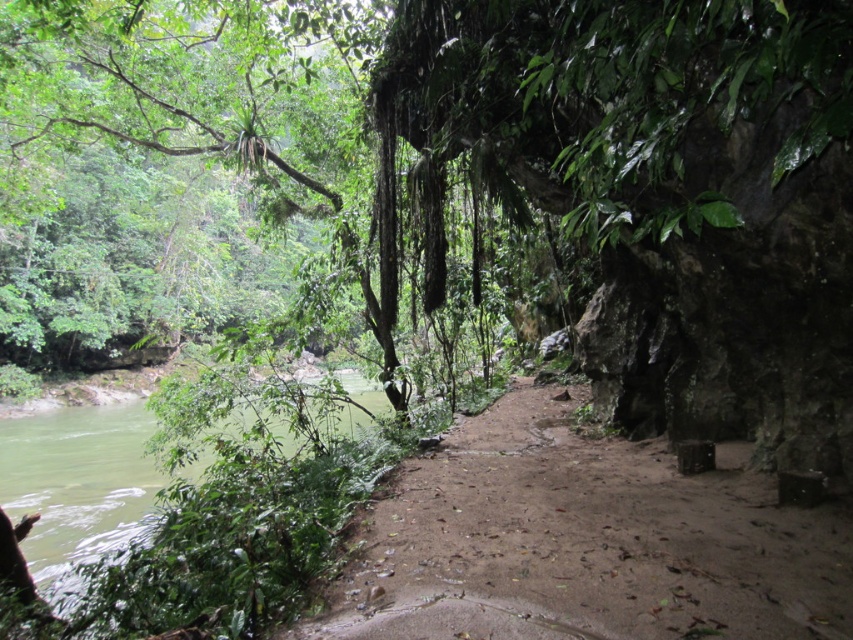
Question: Which point is farther to the camera?

Choices:
 (A) green leafy tree at upper left
 (B) brown sandy dirt track at center

Answer: (A)

Question: Does green leafy tree at upper left have a greater width compared to brown sandy dirt track at center?

Choices:
 (A) yes
 (B) no

Answer: (A)

Question: Which of the following is the closest to the observer?

Choices:
 (A) green leafy tree at upper left
 (B) brown sandy dirt track at center

Answer: (B)

Question: Does green leafy tree at upper left appear under brown sandy dirt track at center?

Choices:
 (A) yes
 (B) no

Answer: (B)

Question: Among these objects, which one is nearest to the camera?

Choices:
 (A) green leafy tree at upper left
 (B) brown sandy dirt track at center

Answer: (B)

Question: Does green leafy tree at upper left appear under brown sandy dirt track at center?

Choices:
 (A) yes
 (B) no

Answer: (B)